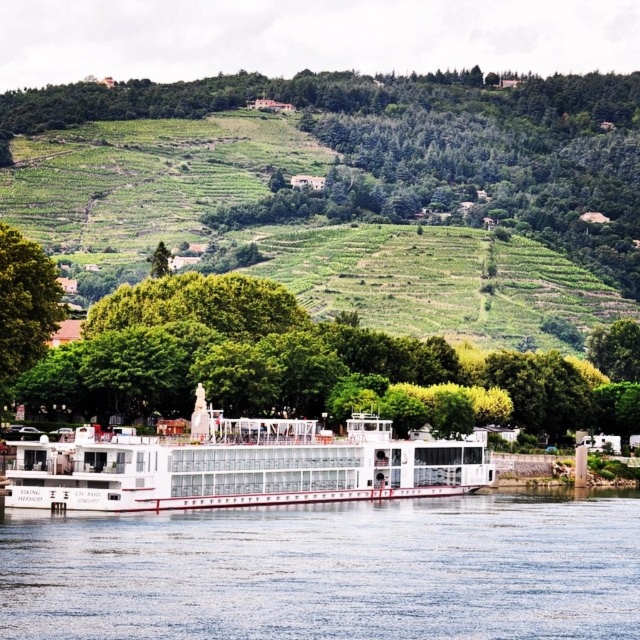
You are an observer standing on the riverside and see the green leafy tree at center and the white glassy boat at center. Which object appears wider from your perspective?

The green leafy tree at center appears wider than the white glassy boat at center because its width is larger.

You are a boat captain planning to navigate a small boat through the river. The boat requires a minimum of 30 meters of clear space between obstacles to safely pass. Given the distance between the blue glassy water at lower center and the green leafy tree at left, can you safely navigate your boat between them?

The blue glassy water at lower center is 31.49 meters from the green leafy tree at left. Since the required minimum distance is 30 meters, the 31.49 meters provides sufficient space for safe navigation between them.

You are a small drone operator who needs to fly your drone from the green leafy tree at left to the white glassy boat at center. Your drone has a maximum flight range of 15 meters. Can your drone make the trip without needing to recharge?

The distance between the green leafy tree at left and the white glassy boat at center is 16.02 meters. Since the drone can only fly 15 meters before needing to recharge, it cannot make the trip without recharging.